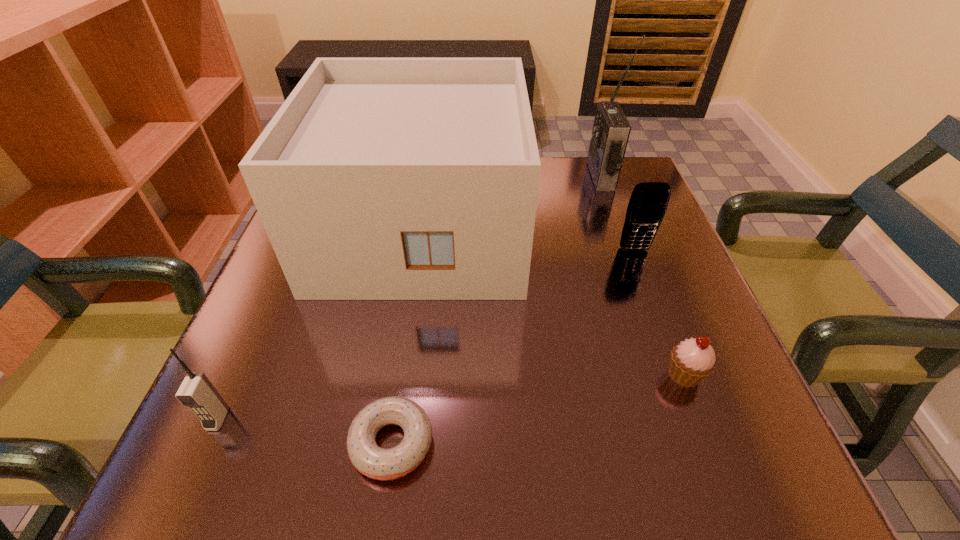
Find the location of a particular element. free space that satisfies the following two spatial constraints: 1. on the side of the fifth shortest object with the window; 2. on the right side of the shortest object is located at coordinates (390, 443).